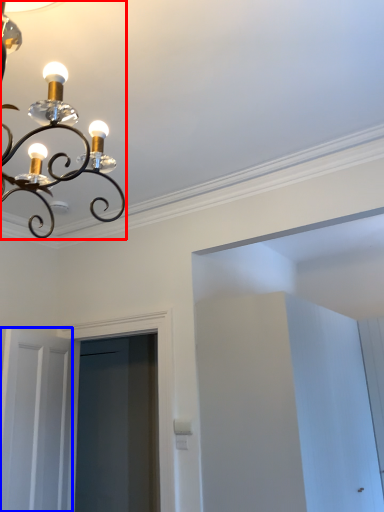
Question: Which object is further to the camera taking this photo, lamp (highlighted by a red box) or door (highlighted by a blue box)?

Choices:
 (A) lamp
 (B) door

Answer: (B)